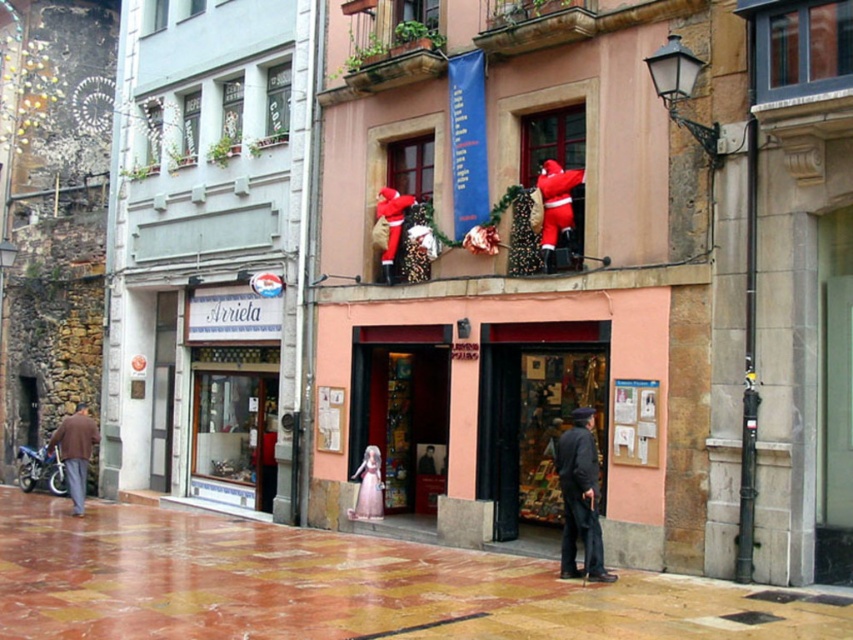
Question: Can you confirm if marble at center is smaller than brown woolen jacket at lower left?

Choices:
 (A) yes
 (B) no

Answer: (B)

Question: Which object appears closest to the camera in this image?

Choices:
 (A) velvet red santa at upper right
 (B) marble at center
 (C) brown woolen jacket at lower left

Answer: (B)

Question: Which point is closer to the camera?

Choices:
 (A) (604, 579)
 (B) (337, 625)
 (C) (386, 227)

Answer: (B)

Question: Is marble at center to the left of matte red santa at upper center from the viewer's perspective?

Choices:
 (A) no
 (B) yes

Answer: (B)

Question: Which is farther from the dark gray wool coat at lower center?

Choices:
 (A) velvet red santa at upper right
 (B) matte red santa at upper center

Answer: (B)

Question: Can you confirm if dark gray wool coat at lower center is bigger than brown woolen jacket at lower left?

Choices:
 (A) yes
 (B) no

Answer: (B)